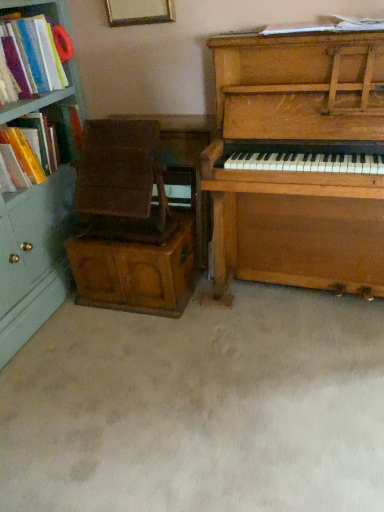
Question: From a real-world perspective, is wooden piano at right physically located above or below matte plastic books at left, marked as the third book in a right-to-left arrangement?

Choices:
 (A) above
 (B) below

Answer: (B)

Question: Is wooden piano at right in front of or behind matte plastic books at left, marked as the third book in a right-to-left arrangement, in the image?

Choices:
 (A) behind
 (B) front

Answer: (B)

Question: Which of these objects is positioned farthest from the wooden picture frame at upper center?

Choices:
 (A) matte plastic book at left, the second book when ordered from right to left
 (B) wooden piano at right
 (C) white paper at upper center, positioned as the 3th book in left-to-right order
 (D) wooden armchair at center-left, which ranks as the 2th armchair in top-to-bottom order
 (E) wooden armchair at left, which is counted as the 2th armchair, starting from the bottom

Answer: (B)

Question: Which of these objects is positioned closest to the white paper at upper center, positioned as the 3th book in left-to-right order?

Choices:
 (A) wooden piano at right
 (B) wooden armchair at left, acting as the first armchair starting from the top
 (C) wooden picture frame at upper center
 (D) matte plastic book at left, the second book when ordered from right to left
 (E) matte plastic books at left, marked as the third book in a right-to-left arrangement

Answer: (A)